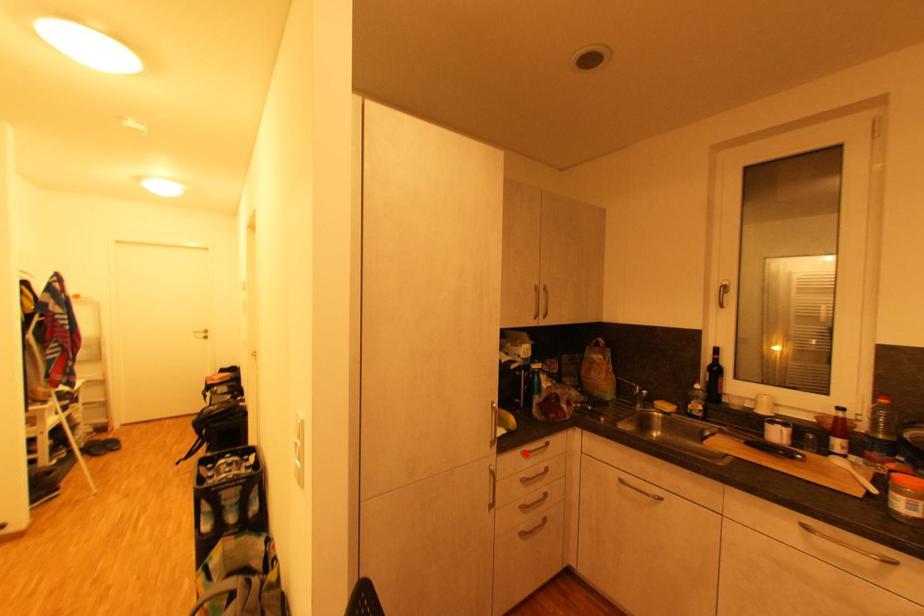
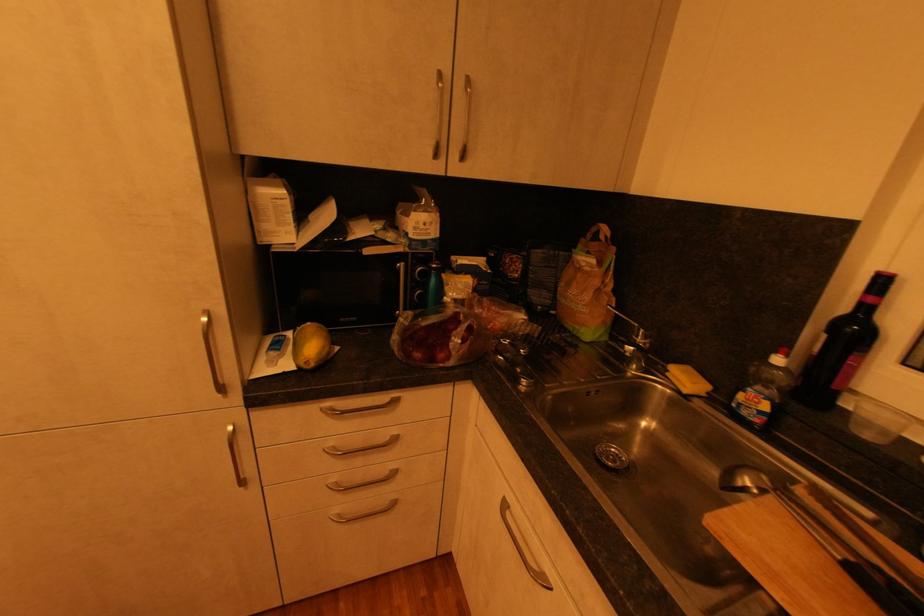
In the second image, find the point that corresponds to the highlighted location in the first image.

(325, 410)